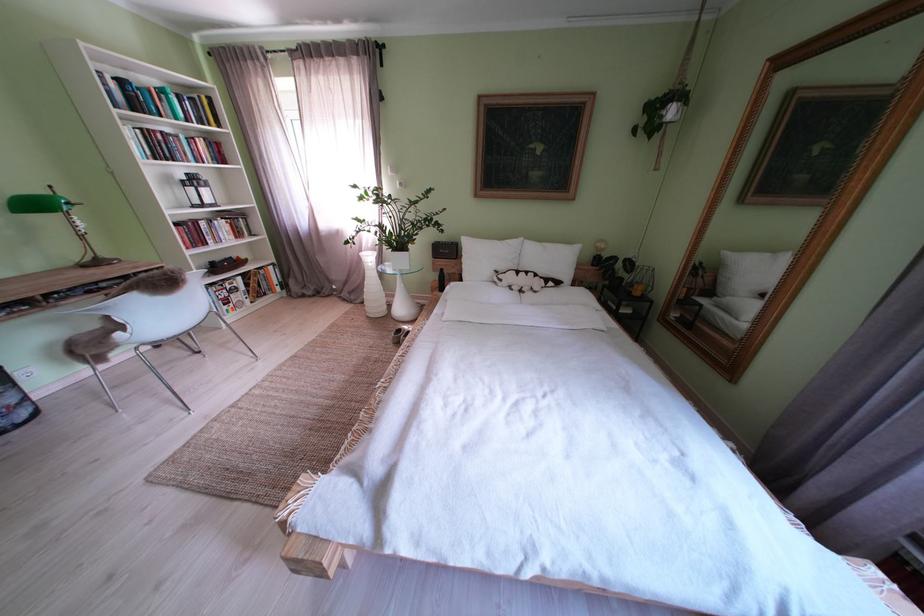
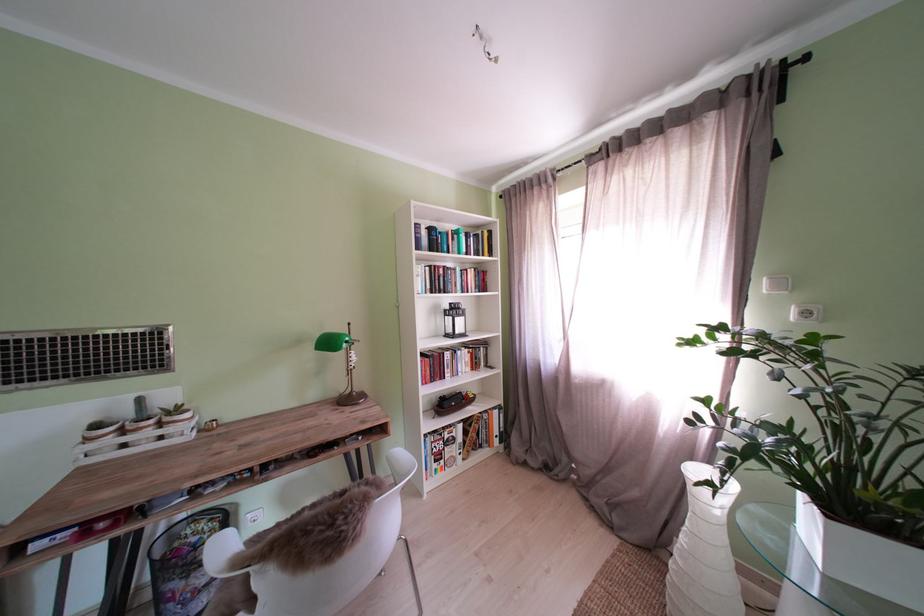
The point at (346, 47) is marked in the first image. Where is the corresponding point in the second image?

(681, 116)